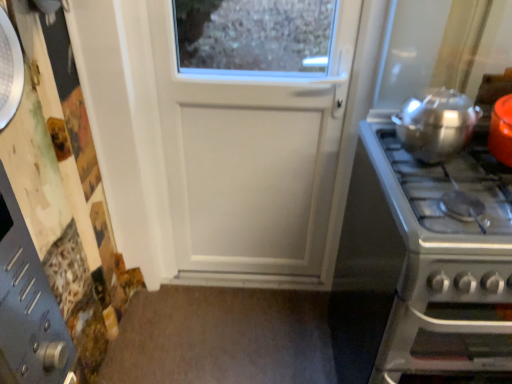
Question: Does point (406, 365) appear closer or farther from the camera than point (433, 150)?

Choices:
 (A) closer
 (B) farther

Answer: (B)

Question: Is satin silver gas stove at right in front of or behind shiny metallic pot at right in the image?

Choices:
 (A) front
 (B) behind

Answer: (A)

Question: Choose the correct answer: Is satin silver gas stove at right inside shiny metallic pot at right or outside it?

Choices:
 (A) inside
 (B) outside

Answer: (B)

Question: Is shiny metallic pot at right wider or thinner than satin silver gas stove at right?

Choices:
 (A) thin
 (B) wide

Answer: (A)

Question: Is shiny metallic pot at right in front of or behind satin silver gas stove at right in the image?

Choices:
 (A) front
 (B) behind

Answer: (B)

Question: From a real-world perspective, is shiny metallic pot at right physically located above or below satin silver gas stove at right?

Choices:
 (A) below
 (B) above

Answer: (B)

Question: Considering the positions of point (471, 125) and point (398, 324), is point (471, 125) closer or farther from the camera than point (398, 324)?

Choices:
 (A) farther
 (B) closer

Answer: (A)